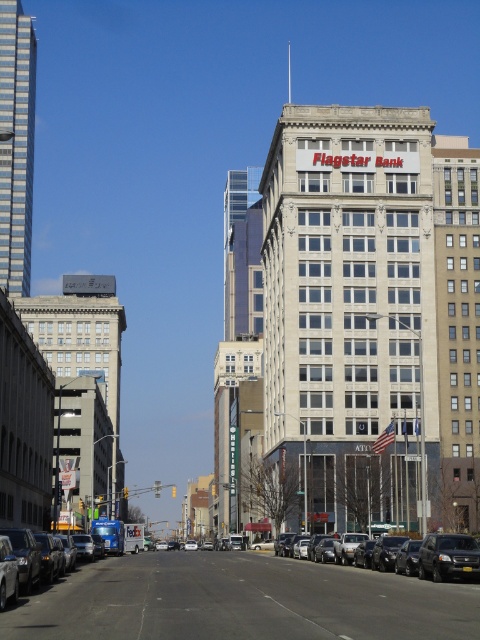
Question: Which point is closer to the camera?

Choices:
 (A) (387, 545)
 (B) (427, 541)

Answer: (B)

Question: Does black glossy sedan at center have a larger size compared to black matte suv at lower right?

Choices:
 (A) no
 (B) yes

Answer: (B)

Question: Is black glossy sedan at center further to camera compared to black matte suv at lower right?

Choices:
 (A) yes
 (B) no

Answer: (A)

Question: Is black glossy sedan at center below black matte suv at lower right?

Choices:
 (A) yes
 (B) no

Answer: (A)

Question: Among these objects, which one is farthest from the camera?

Choices:
 (A) black glossy sedan at center
 (B) black matte suv at lower right

Answer: (A)

Question: Which object is farther from the camera taking this photo?

Choices:
 (A) black glossy sedan at center
 (B) black matte suv at lower right

Answer: (A)